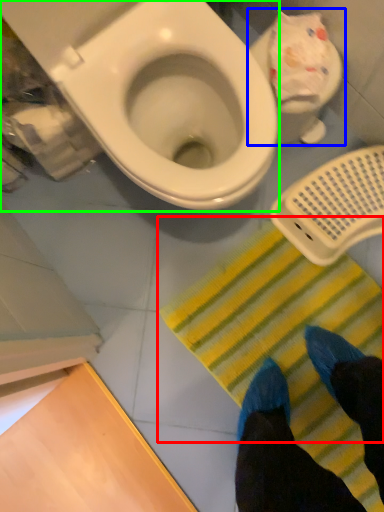
Question: Which object is positioned closest to doormat (highlighted by a red box)? Select from toilet (highlighted by a blue box) and toilet (highlighted by a green box).

Choices:
 (A) toilet
 (B) toilet

Answer: (A)